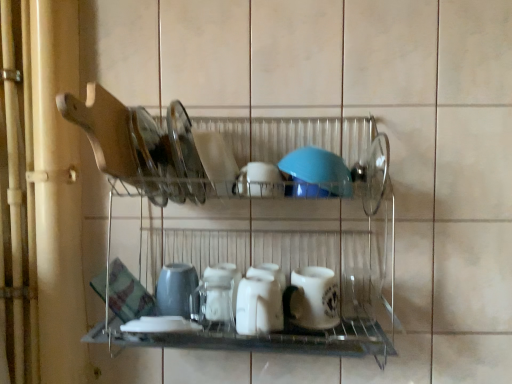
Question: Does blue rubber lid at center, the 1th tableware positioned from the right, have a smaller size compared to matte gray cup at center?

Choices:
 (A) yes
 (B) no

Answer: (B)

Question: From a real-world perspective, is blue rubber lid at center, the 1th tableware positioned from the right, located higher than matte gray cup at center?

Choices:
 (A) no
 (B) yes

Answer: (B)

Question: From a real-world perspective, is blue rubber lid at center, the 1th tableware positioned from the right, under matte gray cup at center?

Choices:
 (A) no
 (B) yes

Answer: (A)

Question: Is blue rubber lid at center, which appears as the 6th tableware when viewed from the left, not close to matte gray cup at center?

Choices:
 (A) yes
 (B) no

Answer: (B)

Question: Is blue rubber lid at center, which appears as the 6th tableware when viewed from the left, aimed at matte gray cup at center?

Choices:
 (A) no
 (B) yes

Answer: (A)

Question: From a real-world perspective, relative to matte gray cup at center, is clear glass plate at upper center, the 1th tableware viewed from the left, vertically above or below?

Choices:
 (A) above
 (B) below

Answer: (A)

Question: Considering the positions of clear glass plate at upper center, positioned as the 6th tableware in right-to-left order, and matte gray cup at center in the image, is clear glass plate at upper center, positioned as the 6th tableware in right-to-left order, wider or thinner than matte gray cup at center?

Choices:
 (A) wide
 (B) thin

Answer: (A)

Question: From their relative heights in the image, would you say clear glass plate at upper center, positioned as the 6th tableware in right-to-left order, is taller or shorter than matte gray cup at center?

Choices:
 (A) short
 (B) tall

Answer: (B)

Question: From the image's perspective, is clear glass plate at upper center, positioned as the 6th tableware in right-to-left order, positioned above or below matte gray cup at center?

Choices:
 (A) below
 (B) above

Answer: (B)

Question: Does point (160, 294) appear closer or farther from the camera than point (336, 304)?

Choices:
 (A) farther
 (B) closer

Answer: (B)

Question: From their relative heights in the image, would you say matte gray cup at center is taller or shorter than white matte mug at center, placed as the 2th tableware when sorted from right to left?

Choices:
 (A) tall
 (B) short

Answer: (A)

Question: From the image's perspective, is matte gray cup at center located above or below white matte mug at center, placed as the 2th tableware when sorted from right to left?

Choices:
 (A) above
 (B) below

Answer: (A)

Question: Looking at their shapes, would you say matte gray cup at center is wider or thinner than white matte mug at center, placed as the 2th tableware when sorted from right to left?

Choices:
 (A) thin
 (B) wide

Answer: (B)

Question: In the image, is clear glass plate at upper center, positioned as the 6th tableware in right-to-left order, positioned in front of or behind blue rubber lid at center, the 1th tableware positioned from the right?

Choices:
 (A) behind
 (B) front

Answer: (B)

Question: From the image's perspective, is clear glass plate at upper center, positioned as the 6th tableware in right-to-left order, located above or below blue rubber lid at center, the 1th tableware positioned from the right?

Choices:
 (A) below
 (B) above

Answer: (B)